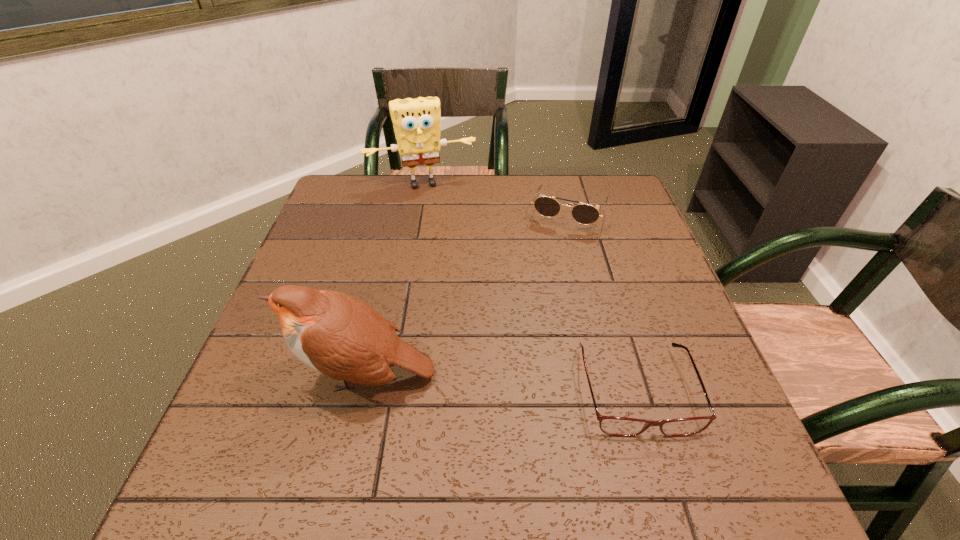
The image size is (960, 540). Identify the location of object that is the closest one to the bird. (616, 426).